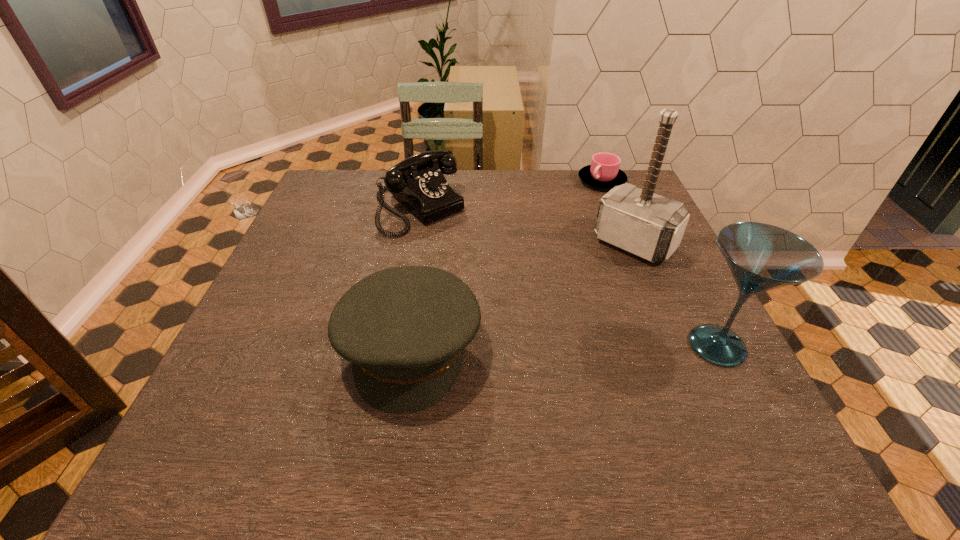
The height and width of the screenshot is (540, 960). I want to click on free space on the desktop that is between the beret and the second tallest object and is positioned on the dial of the telephone, so click(x=576, y=347).

Identify the location of free space on the desktop that is between the beret and the martini and is positioned for striking with the head of the hammer. (532, 347).

Where is `vacant spot on the desktop that is between the beret and the martini and is positioned on the side with the handle of the cup`? vacant spot on the desktop that is between the beret and the martini and is positioned on the side with the handle of the cup is located at coordinates (546, 347).